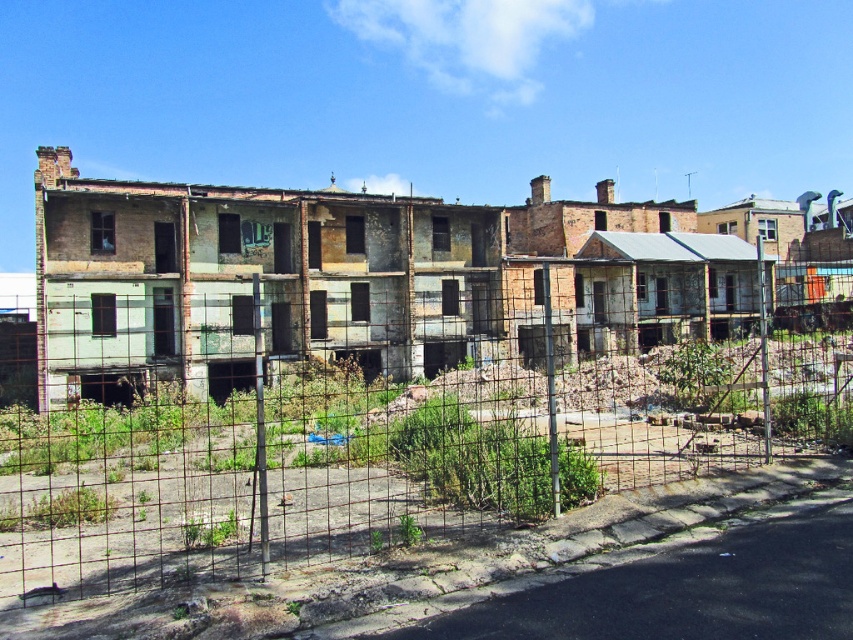
Is rusty wire fence at center smaller than rusty metal building at center?

Correct, rusty wire fence at center occupies less space than rusty metal building at center.

Which is above, rusty wire fence at center or rusty metal building at center?

rusty metal building at center

Between point (250, 568) and point (178, 304), which one is positioned in front?

Point (250, 568)

What are the coordinates of `rusty wire fence at center` in the screenshot? It's located at (387, 454).